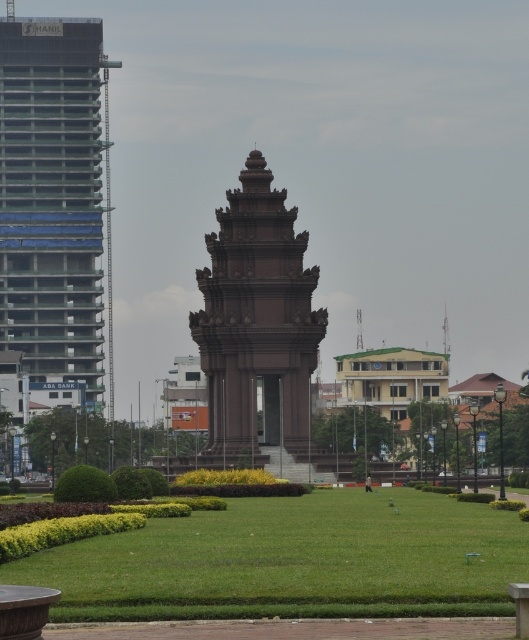
Is green grass at center thinner than concrete building at left?

In fact, green grass at center might be wider than concrete building at left.

Is green grass at center to the left of concrete building at left from the viewer's perspective?

No, green grass at center is not to the left of concrete building at left.

Locate an element on the screen. The image size is (529, 640). green grass at center is located at coordinates (293, 561).

Who is lower down, green grass at center or brown stone tower at center?

green grass at center is below.

Which is in front, point (150, 541) or point (262, 355)?

Point (150, 541) is more forward.

Does point (369, 580) lie behind point (259, 376)?

No.

The height and width of the screenshot is (640, 529). In order to click on green grass at center in this screenshot , I will do `click(293, 561)`.

Does concrete building at left appear under brown stone tower at center?

No, concrete building at left is not below brown stone tower at center.

What do you see at coordinates (54, 200) in the screenshot? I see `concrete building at left` at bounding box center [54, 200].

You are a GUI agent. You are given a task and a screenshot of the screen. Output one action in this format:
    pyautogui.click(x=<x>, y=<y>)
    Task: Click on the concrete building at left
    The height and width of the screenshot is (640, 529).
    Given the screenshot: What is the action you would take?
    pyautogui.click(x=54, y=200)